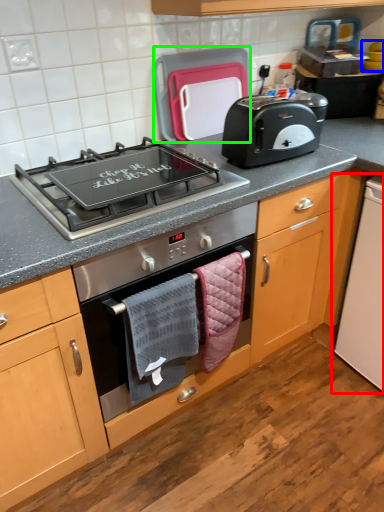
Question: Estimate the real-world distances between objects in this image. Which object is farther from appliance (highlighted by a red box), appliance (highlighted by a blue box) or kitchen appliance (highlighted by a green box)?

Choices:
 (A) appliance
 (B) kitchen appliance

Answer: (A)